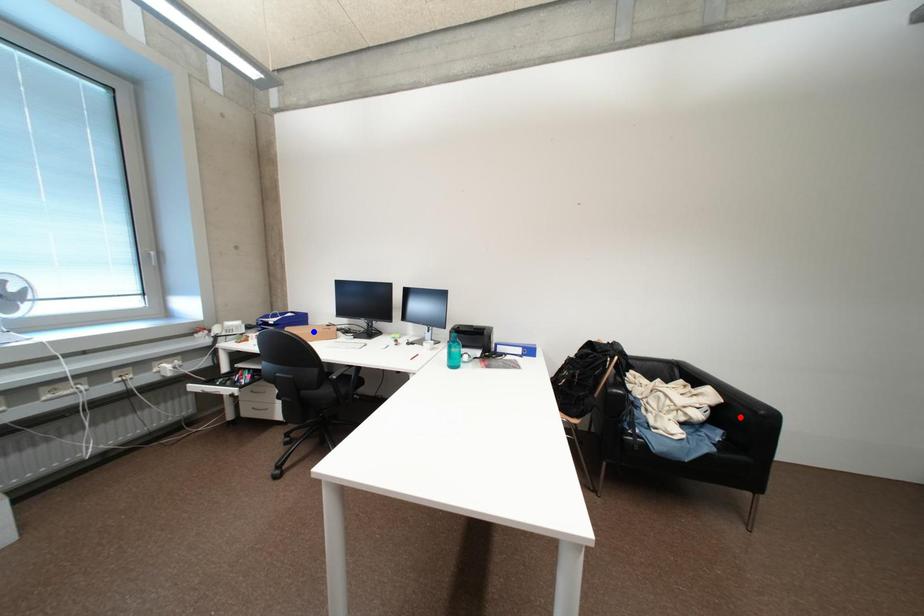
Question: Which of the two points in the image is closer to the camera?

Choices:
 (A) Blue point is closer.
 (B) Red point is closer.

Answer: (B)